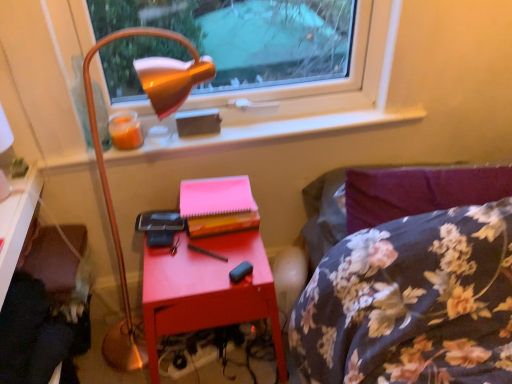
Where is `matte red nightstand at center`? The height and width of the screenshot is (384, 512). matte red nightstand at center is located at coordinates (207, 290).

What do you see at coordinates (218, 205) in the screenshot? I see `pink paper at center` at bounding box center [218, 205].

What do you see at coordinates (105, 170) in the screenshot? I see `metallic gold lamp at upper left` at bounding box center [105, 170].

Based on the photo, in order to face wooden table at lower left, should I rotate leftwards or rightwards?

To face it directly, rotate left by 25.108 degrees.

This screenshot has width=512, height=384. Find the location of `velvet purple swivel chair at lower left`. velvet purple swivel chair at lower left is located at coordinates (33, 336).

In the image, is velvet purple swivel chair at lower left on the left side or the right side of matte plastic window sill at upper center?

Based on their positions, velvet purple swivel chair at lower left is located to the left of matte plastic window sill at upper center.

Looking at the image, does velvet purple swivel chair at lower left seem bigger or smaller compared to matte plastic window sill at upper center?

Clearly, velvet purple swivel chair at lower left is larger in size than matte plastic window sill at upper center.

Based on the photo, is velvet purple swivel chair at lower left looking in the opposite direction of matte plastic window sill at upper center?

No, velvet purple swivel chair at lower left is not facing away from matte plastic window sill at upper center.

From the image's perspective, which is below, velvet purple swivel chair at lower left or matte plastic window sill at upper center?

velvet purple swivel chair at lower left.

Looking at this image, considering the relative positions of matte plastic window sill at upper center and matte wood desk at lower left in the image provided, is matte plastic window sill at upper center to the left of matte wood desk at lower left from the viewer's perspective?

No.

Is point (61, 161) less distant than point (27, 206)?

No.

Can you tell me how much matte plastic window sill at upper center and matte wood desk at lower left differ in facing direction?

88.8 degrees separate the facing orientations of matte plastic window sill at upper center and matte wood desk at lower left.

From the image's perspective, which is below, matte plastic window sill at upper center or matte wood desk at lower left?

From the image's view, matte wood desk at lower left is below.

Which of these two, matte red nightstand at center or wooden table at lower left, stands shorter?

Standing shorter between the two is matte red nightstand at center.

Considering the points (244, 286) and (46, 377), which point is behind, point (244, 286) or point (46, 377)?

The point (244, 286) is farther.

Does matte red nightstand at center appear on the left side of wooden table at lower left?

In fact, matte red nightstand at center is to the right of wooden table at lower left.

Is wooden table at lower left positioned with its back to matte plastic window sill at upper center?

That's not correct — wooden table at lower left is not looking away from matte plastic window sill at upper center.

Considering the relative positions of wooden table at lower left and matte plastic window sill at upper center in the image provided, is wooden table at lower left to the left of matte plastic window sill at upper center from the viewer's perspective?

Yes, wooden table at lower left is to the left of matte plastic window sill at upper center.

Which object is wider, wooden table at lower left or matte plastic window sill at upper center?

Wider between the two is wooden table at lower left.

Is matte plastic window sill at upper center positioned far away from velvet purple swivel chair at lower left?

No.

Looking at this image, which of these two, matte plastic window sill at upper center or velvet purple swivel chair at lower left, is smaller?

With smaller size is matte plastic window sill at upper center.

Which is closer, [350,122] or [73,366]?

Point [350,122] is positioned closer to the camera compared to point [73,366].

Where is `window sill above the velvet purple swivel chair at lower left (from a real-world perspective)`? This screenshot has height=384, width=512. window sill above the velvet purple swivel chair at lower left (from a real-world perspective) is located at coordinates (255, 133).

Which object is more forward, pink paper at center or metallic gold lamp at upper left?

Positioned in front is metallic gold lamp at upper left.

Could you tell me if pink paper at center is facing metallic gold lamp at upper left?

Yes, pink paper at center is facing metallic gold lamp at upper left.

Measure the distance from pink paper at center to metallic gold lamp at upper left.

A distance of 34.39 centimeters exists between pink paper at center and metallic gold lamp at upper left.

From a real-world perspective, is pink paper at center above or below metallic gold lamp at upper left?

pink paper at center is above metallic gold lamp at upper left.

Which point is more forward, (28, 350) or (20, 367)?

The point (20, 367) is in front.

Is wooden table at lower left at the left side of velvet purple swivel chair at lower left?

Correct, you'll find wooden table at lower left to the left of velvet purple swivel chair at lower left.

Is the depth of wooden table at lower left greater than that of velvet purple swivel chair at lower left?

Yes, it is behind velvet purple swivel chair at lower left.

Image resolution: width=512 pixels, height=384 pixels. Find the location of `swivel chair below the matte plastic window sill at upper center (from a real-world perspective)`. swivel chair below the matte plastic window sill at upper center (from a real-world perspective) is located at coordinates (33, 336).

Where is `desk to the left of matte plastic window sill at upper center`? Image resolution: width=512 pixels, height=384 pixels. desk to the left of matte plastic window sill at upper center is located at coordinates (16, 223).

When comparing their distances from velvet purple swivel chair at lower left, does matte plastic window sill at upper center or matte red nightstand at center seem closer?

Among the two, matte red nightstand at center is located nearer to velvet purple swivel chair at lower left.

Looking at the image, which one is located closer to metallic gold lamp at upper left, velvet purple swivel chair at lower left or matte red nightstand at center?

The object closer to metallic gold lamp at upper left is matte red nightstand at center.

When comparing their distances from matte wood desk at lower left, does metallic gold lamp at upper left or matte plastic window sill at upper center seem closer?

metallic gold lamp at upper left is closer to matte wood desk at lower left.

In the scene shown: Which object lies nearer to the anchor point velvet purple swivel chair at lower left, matte plastic window sill at upper center or matte wood desk at lower left?

Based on the image, matte wood desk at lower left appears to be nearer to velvet purple swivel chair at lower left.

Based on the photo, when comparing their distances from matte plastic window sill at upper center, does pink paper at center or matte red nightstand at center seem further?

matte red nightstand at center is further to matte plastic window sill at upper center.

Considering their positions, is velvet purple swivel chair at lower left positioned further to matte plastic window sill at upper center than matte wood desk at lower left?

velvet purple swivel chair at lower left lies further to matte plastic window sill at upper center than the other object.

Based on the photo, from the image, which object appears to be nearer to matte plastic window sill at upper center, metallic gold lamp at upper left or matte wood desk at lower left?

The object closer to matte plastic window sill at upper center is metallic gold lamp at upper left.

Which object lies further to the anchor point matte wood desk at lower left, matte red nightstand at center or wooden table at lower left?

matte red nightstand at center is further to matte wood desk at lower left.

The width and height of the screenshot is (512, 384). Identify the location of desk that lies between metallic gold lamp at upper left and velvet purple swivel chair at lower left from top to bottom. (16, 223).

The height and width of the screenshot is (384, 512). In order to click on swivel chair between wooden table at lower left and pink paper at center in this screenshot , I will do `click(33, 336)`.

Identify the location of paperback book between matte plastic window sill at upper center and matte red nightstand at center from top to bottom. (218, 205).

Locate an element on the screen. This screenshot has width=512, height=384. paperback book located between metallic gold lamp at upper left and matte plastic window sill at upper center in the depth direction is located at coordinates (218, 205).